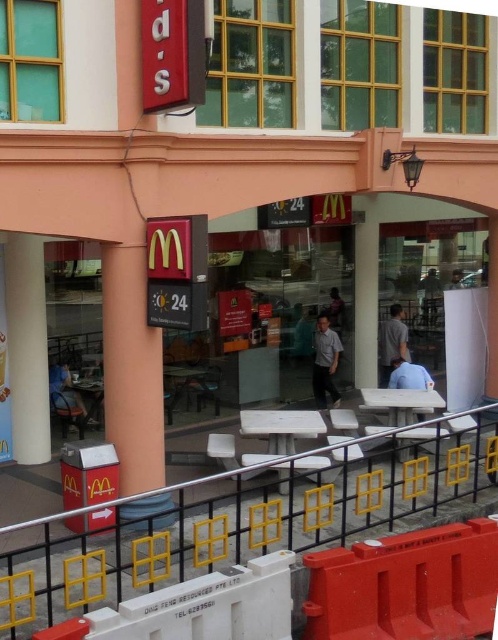
You are a customer standing outside the McDonalds restaurant looking through the large glass doors. You see two shirts inside the gray fabric shirt at center and the blue fabric shirt at lower center. Which shirt is closer to you?

The gray fabric shirt at center is closer to you because the blue fabric shirt at lower center is behind it.

You are standing on a balcony overlooking a McDonalds restaurant. You see a metallic yellow fence at lower center and a light blue shirt at center. Which object is located to the left when viewed from your perspective?

The metallic yellow fence at lower center is positioned on the left side of the light blue shirt at center, so from your perspective on the balcony, the metallic yellow fence at lower center is to the left of the light blue shirt at center.

You are standing outside the McDonalds and want to see the entrance clearly. The metallic yellow fence at lower center and the light blue shirt at center are in your line of sight. Which object is shorter and might not block your view?

The metallic yellow fence at lower center is shorter than the light blue shirt at center, so it is less likely to block your view of the entrance.